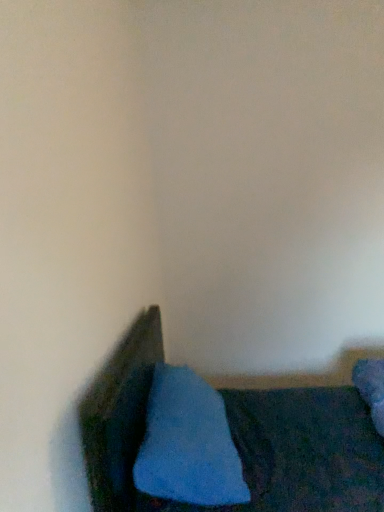
The width and height of the screenshot is (384, 512). What do you see at coordinates (188, 443) in the screenshot? I see `blue soft pillow at lower left` at bounding box center [188, 443].

The image size is (384, 512). I want to click on blue soft pillow at lower left, so (188, 443).

Locate an element on the screen. The height and width of the screenshot is (512, 384). blue soft pillow at lower left is located at coordinates (188, 443).